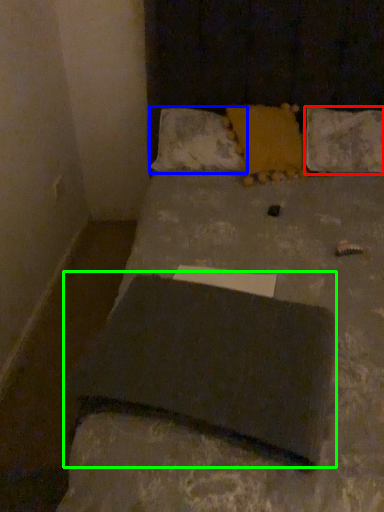
Question: Which is farther away from pillow (highlighted by a red box)? pillow (highlighted by a blue box) or slate (highlighted by a green box)?

Choices:
 (A) pillow
 (B) slate

Answer: (B)